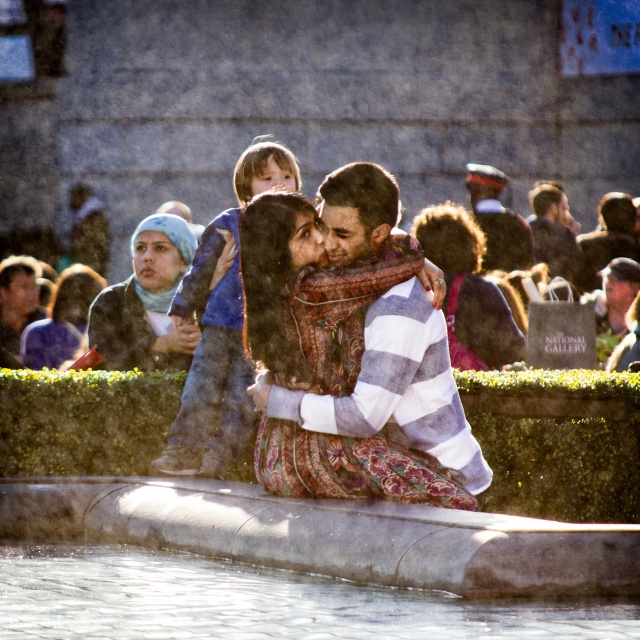
Question: Which object is positioned farthest from the gray stone fountain at center?

Choices:
 (A) floral dress at center
 (B) blue fabric headscarf at upper left
 (C) matte blue scarf at upper left
 (D) clear water at lower center

Answer: (C)

Question: Is floral dress at center wider than matte blue scarf at upper left?

Choices:
 (A) yes
 (B) no

Answer: (A)

Question: Is striped cotton sweater at center to the left of floral dress at center from the viewer's perspective?

Choices:
 (A) no
 (B) yes

Answer: (B)

Question: Which object is closer to the camera taking this photo?

Choices:
 (A) blue fabric headscarf at upper left
 (B) clear water at lower center

Answer: (B)

Question: Estimate the real-world distances between objects in this image. Which object is closer to the clear water at lower center?

Choices:
 (A) striped cotton sweater at center
 (B) blue denim jeans at center

Answer: (A)

Question: Considering the relative positions of striped cotton sweater at center and floral dress at center in the image provided, where is striped cotton sweater at center located with respect to floral dress at center?

Choices:
 (A) right
 (B) left

Answer: (B)